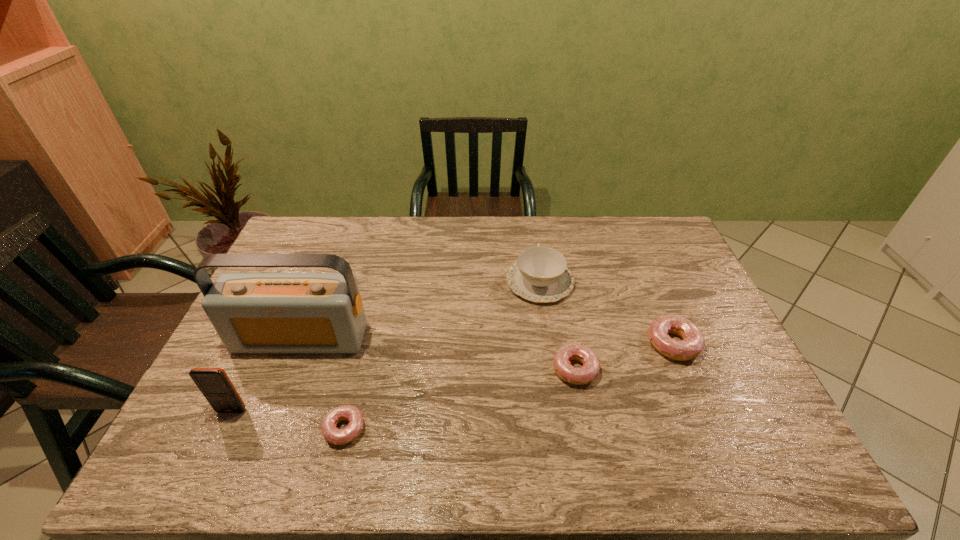
What are the coordinates of `vacant space located on the right of the leftmost doughnut` in the screenshot? It's located at (501, 429).

Locate an element on the screen. vacant region located on the back of the second shortest object is located at coordinates (559, 284).

Where is `free space located on the back of the fourth tallest object`? This screenshot has width=960, height=540. free space located on the back of the fourth tallest object is located at coordinates (649, 286).

Image resolution: width=960 pixels, height=540 pixels. In order to click on vacant space situated 0.050m on the front-facing side of the radio receiver in this screenshot , I will do `click(288, 370)`.

You are a GUI agent. You are given a task and a screenshot of the screen. Output one action in this format:
    pyautogui.click(x=<x>, y=<y>)
    Task: Click on the free space located 0.090m on the handle side of the fourth shortest object
    The height and width of the screenshot is (540, 960).
    Given the screenshot: What is the action you would take?
    pyautogui.click(x=535, y=245)

Identify the location of vacant space located on the handle side of the fourth shortest object. pyautogui.click(x=534, y=240).

Locate an element on the screen. vacant point located 0.160m on the handle side of the fourth shortest object is located at coordinates (533, 233).

Find the location of `doughnut located at the near edge`. doughnut located at the near edge is located at coordinates (333, 435).

The image size is (960, 540). In order to click on cellular telephone present at the near edge in this screenshot , I will do `click(215, 385)`.

Identify the location of radio receiver that is at the left edge. (251, 312).